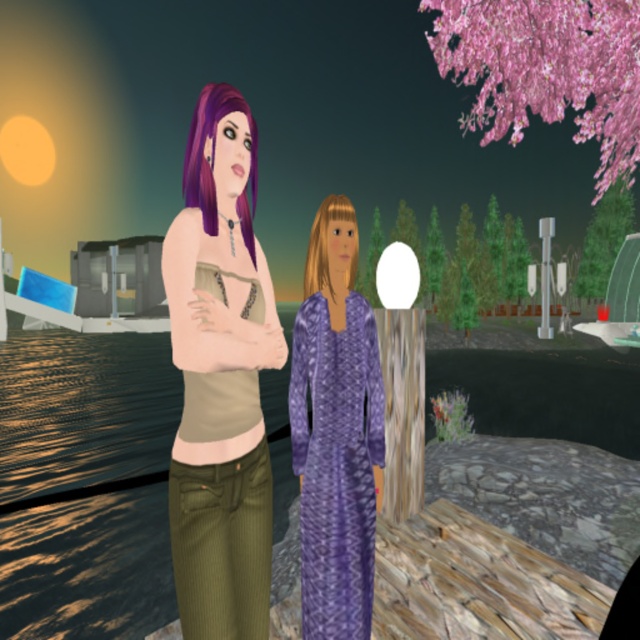
You are a game developer designing a platformer level where the player must jump between platforms. In the scene, there is a blondehair at center and a wooden post at center. Which object is positioned lower in the scene?

The blondehair at center is positioned below the wooden post at center, so it is lower in the scene.

You are a game developer designing a new level where the blondehair at center and wooden post at center must be placed on a platform. Which object should be positioned first to ensure there is enough space for both?

The blondehair at center should be positioned first since it occupies less space than the wooden post at center, ensuring there is enough room for both objects on the platform.

You are a game character trying to hide behind an object. You have a purple velvet dress at center and a wooden post at center in front of you. Which object can you hide behind so that the other object doesn

The wooden post at center is larger than the purple velvet dress at center, so you can hide behind the wooden post at center to fully conceal yourself from the other object.